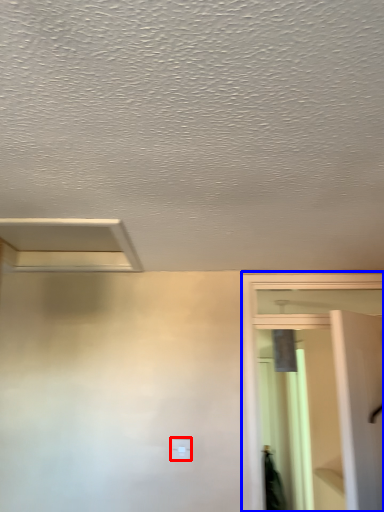
Question: Which of the following is the farthest to the observer, light switch (highlighted by a red box) or screen door (highlighted by a blue box)?

Choices:
 (A) light switch
 (B) screen door

Answer: (A)